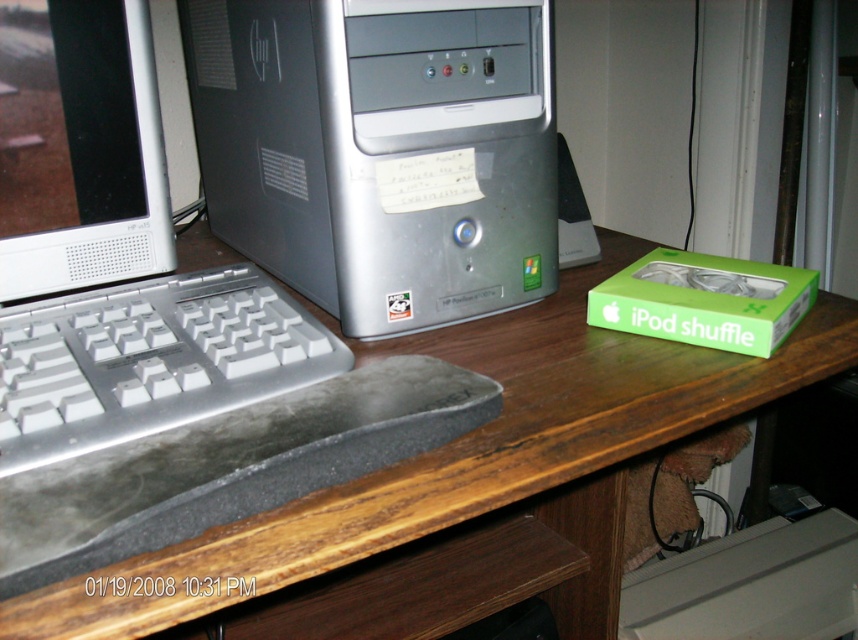
You have a small toy car that is 10 cm long. You want to place it on the wooden at center and the black rubber mouse at center. Which object can it fit on without hanging over the edge?

The wooden at center is wider than the black rubber mouse at center. Since the toy car is 10 cm long, it can fit on the wooden at center without hanging over the edge.

What is the exact 2D coordinate of the wooden at center?

The wooden at center is located at the point with coordinates 0.703 in the x axis and 0.548 in the y axis.